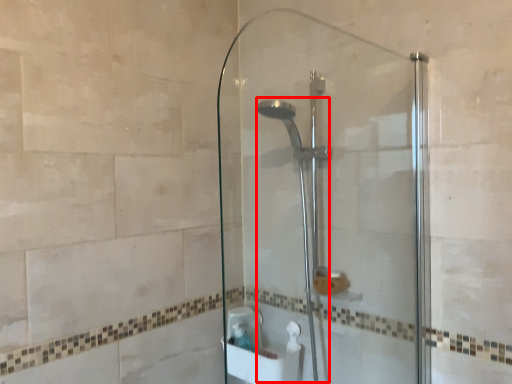
Question: Considering the relative positions of shower (annotated by the red box) and screen door in the image provided, where is shower (annotated by the red box) located with respect to the staircase?

Choices:
 (A) left
 (B) right

Answer: (A)